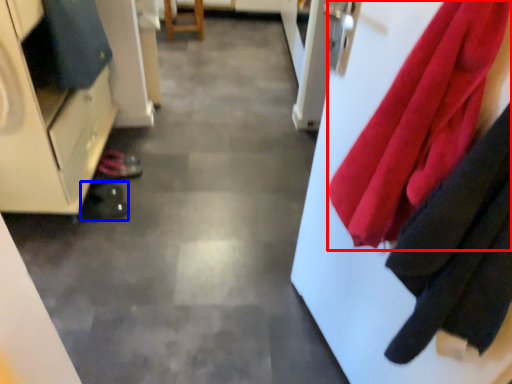
Question: Which object is further to the camera taking this photo, cloth (highlighted by a red box) or shoe (highlighted by a blue box)?

Choices:
 (A) cloth
 (B) shoe

Answer: (B)